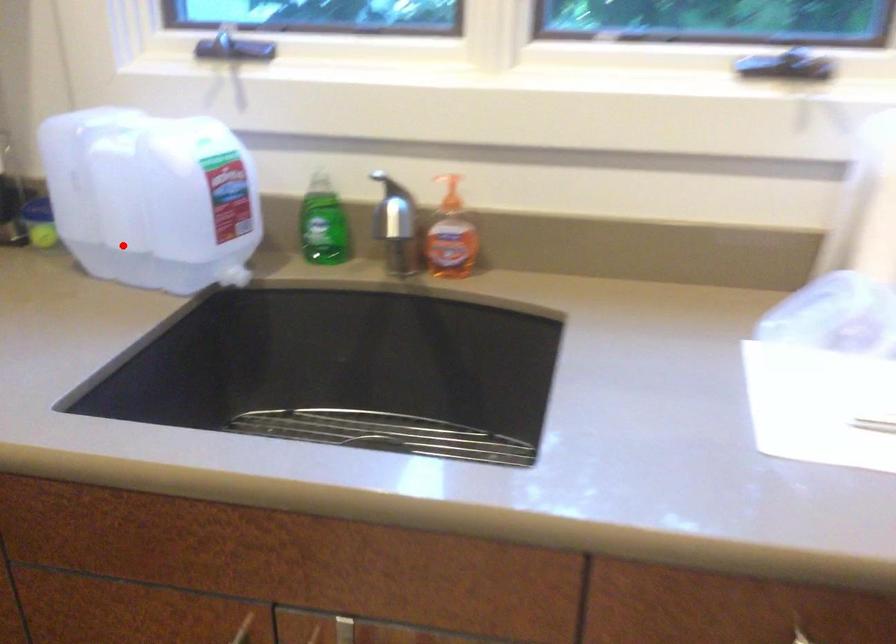
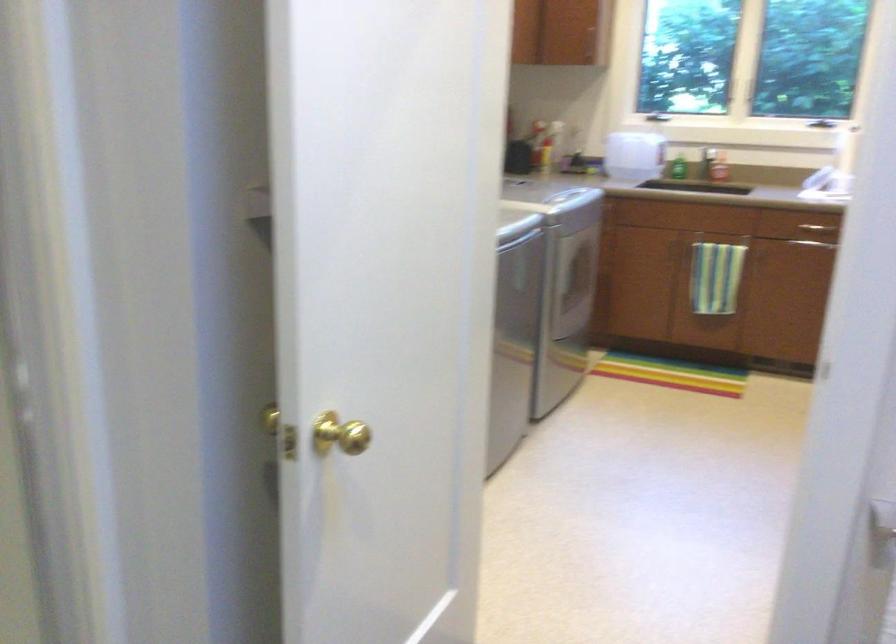
The point at the highlighted location is marked in the first image. Where is the corresponding point in the second image?

(633, 155)